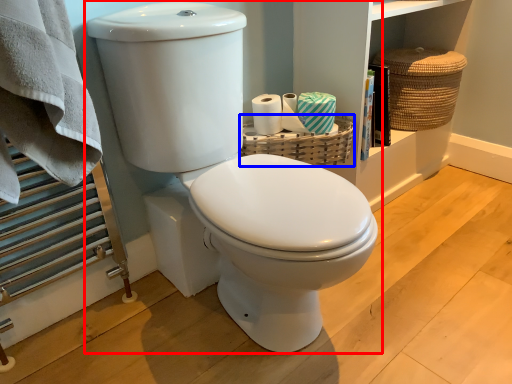
Question: Which point is closer to the camera, toilet (highlighted by a red box) or basket (highlighted by a blue box)?

Choices:
 (A) toilet
 (B) basket

Answer: (A)